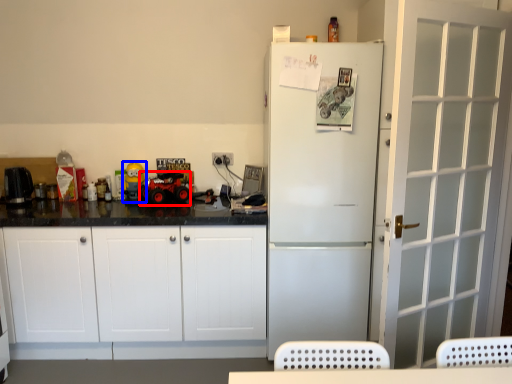
Question: Among these objects, which one is nearest to the camera, toy car (highlighted by a red box) or toy (highlighted by a blue box)?

Choices:
 (A) toy car
 (B) toy

Answer: (A)